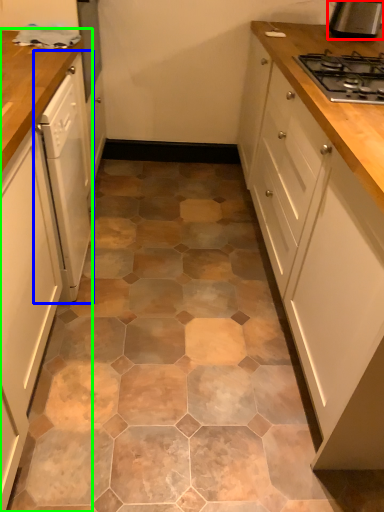
Question: Which object is the closest to the kitchen appliance (highlighted by a red box)? Choose among these: home appliance (highlighted by a blue box) or cabinetry (highlighted by a green box).

Choices:
 (A) home appliance
 (B) cabinetry

Answer: (A)